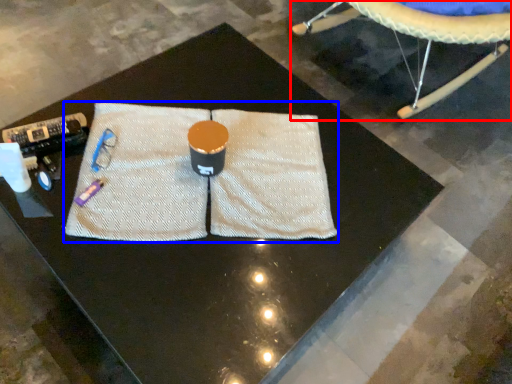
Question: Among these objects, which one is farthest to the camera, swivel chair (highlighted by a red box) or yoga mat (highlighted by a blue box)?

Choices:
 (A) swivel chair
 (B) yoga mat

Answer: (A)